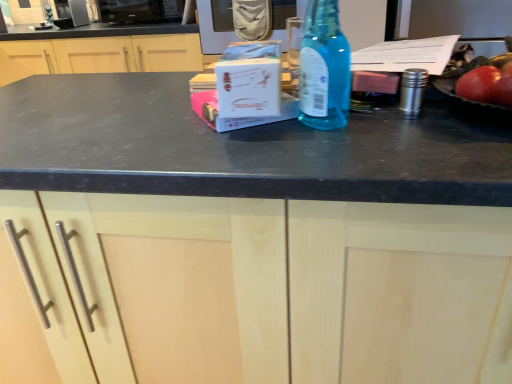
Locate an element on the screen. This screenshot has width=512, height=384. free spot to the left of blue glass bottle at center is located at coordinates (200, 141).